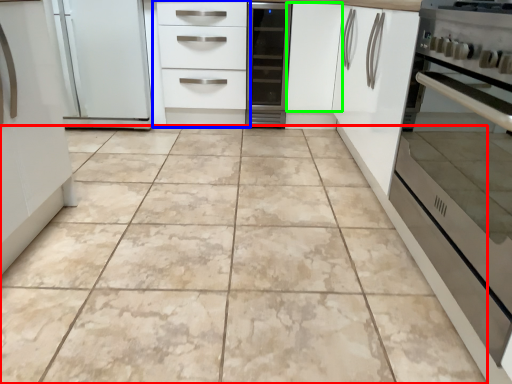
Question: Considering the real-world distances, which object is farthest from ceramic tile (highlighted by a red box)? chest of drawers (highlighted by a blue box) or cabinetry (highlighted by a green box)?

Choices:
 (A) chest of drawers
 (B) cabinetry

Answer: (B)